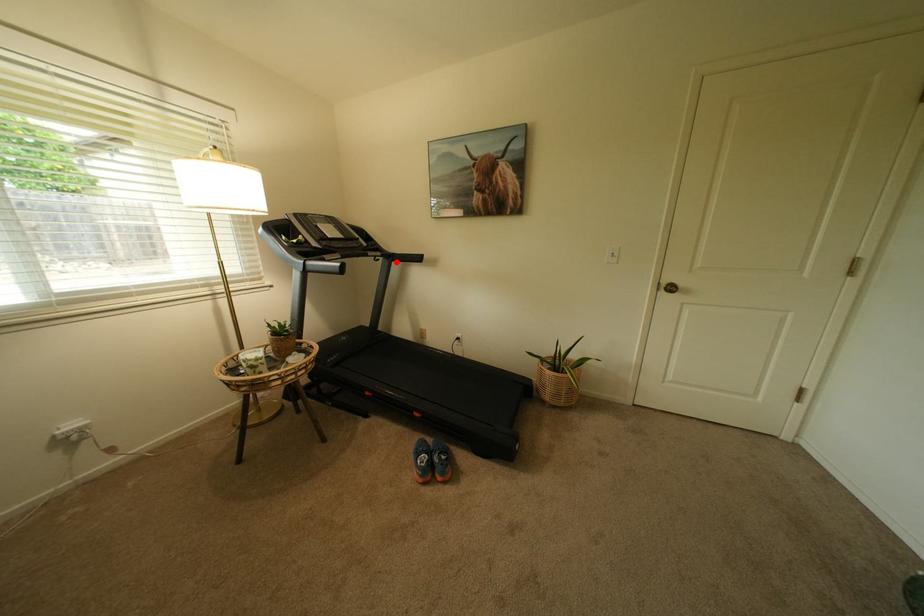
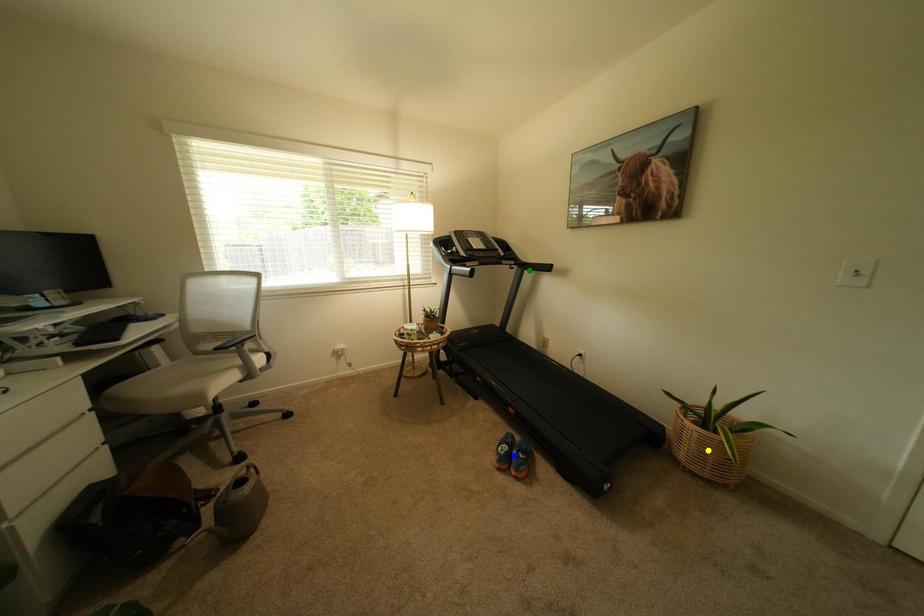
Question: I am providing you with two images of the same scene from different viewpoints. A red point is marked on the first image. You are given multiple points on the second image. In image 2, which mark is for the same physical point as the one in image 1?

Choices:
 (A) green point
 (B) yellow point
 (C) blue point

Answer: (A)